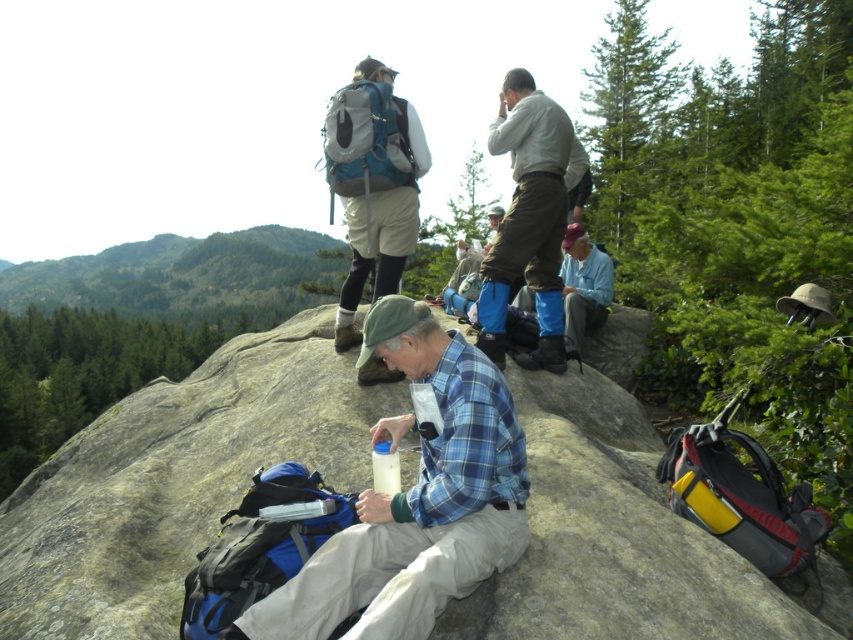
Question: Which object is the closest to the matte gray shirt at upper center?

Choices:
 (A) light blue flannel shirt at center
 (B) blue plaid shirt at center

Answer: (A)

Question: Is blue plaid shirt at center wider than matte gray shirt at upper center?

Choices:
 (A) no
 (B) yes

Answer: (B)

Question: Is blue plaid shirt at center above matte gray shirt at upper center?

Choices:
 (A) no
 (B) yes

Answer: (A)

Question: Which point is farther to the camera?

Choices:
 (A) (577, 164)
 (B) (381, 518)
 (C) (590, 445)
 (D) (584, 316)

Answer: (D)

Question: Is blue plaid shirt at center further to the viewer compared to matte gray shirt at upper center?

Choices:
 (A) no
 (B) yes

Answer: (A)

Question: Which of the following is the farthest from the observer?

Choices:
 (A) matte gray shirt at upper center
 (B) blue plaid shirt at center
 (C) smooth gray rock at center
 (D) light blue flannel shirt at center

Answer: (D)